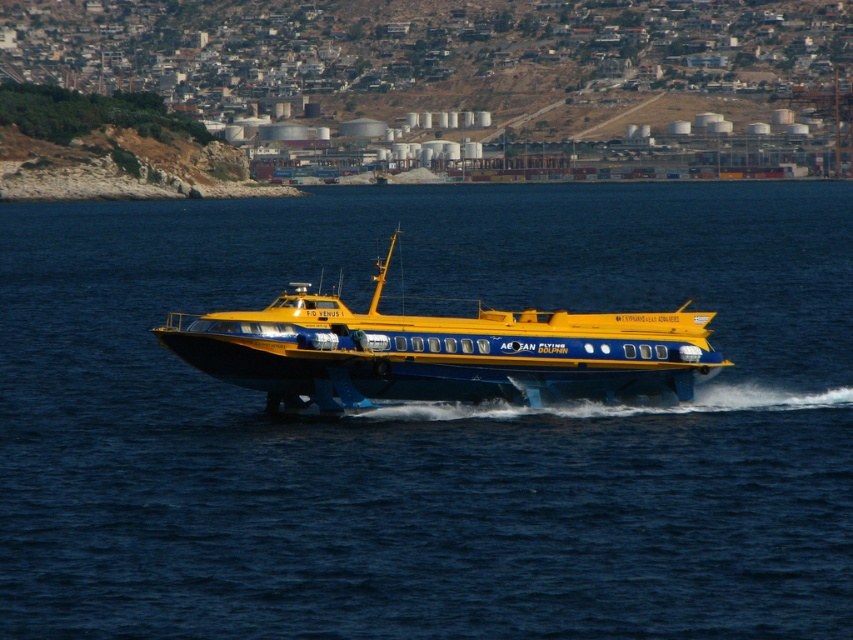
You are a photographer trying to capture the hydrofoil boat and the surrounding water in a single shot. Given that the blue water at center takes up more space than the yellow matte hydrofoil at center, which object should you focus on to ensure both are visible in the frame?

Since the blue water at center is bigger than the yellow matte hydrofoil at center, you should focus on the blue water at center to ensure both objects are visible in the frame.

You are a passenger on the yellow matte hydrofoil at center and want to see the blue water at center. In which direction should you look from your current position on the boat?

The blue water at center is to the left of the yellow matte hydrofoil at center, so you should look to your left to see the blue water at center.